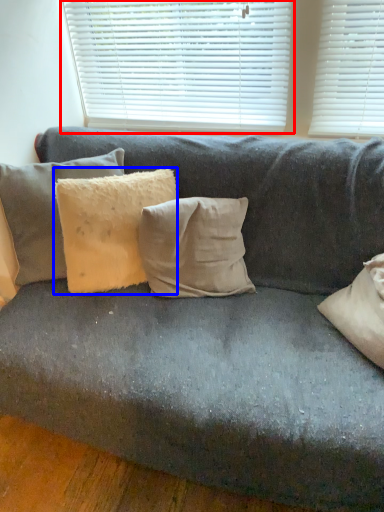
Question: Among these objects, which one is nearest to the camera, window blind (highlighted by a red box) or pillow (highlighted by a blue box)?

Choices:
 (A) window blind
 (B) pillow

Answer: (B)